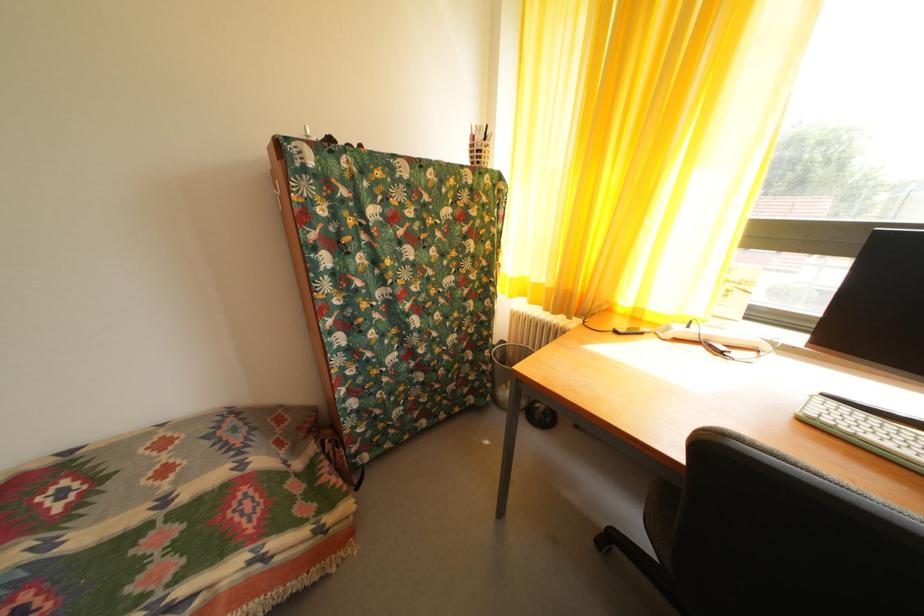
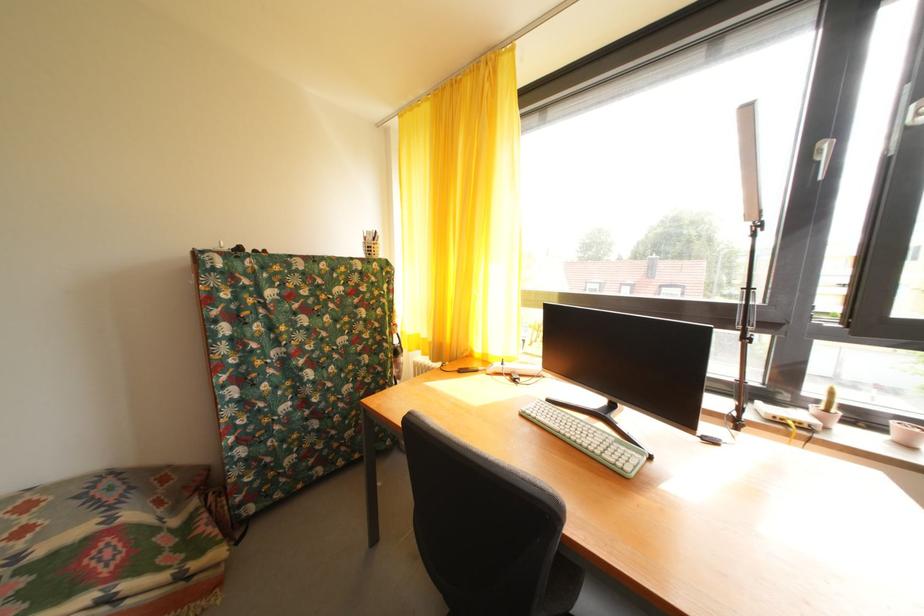
Locate, in the second image, the point that corresponds to (174,477) in the first image.

(31, 538)